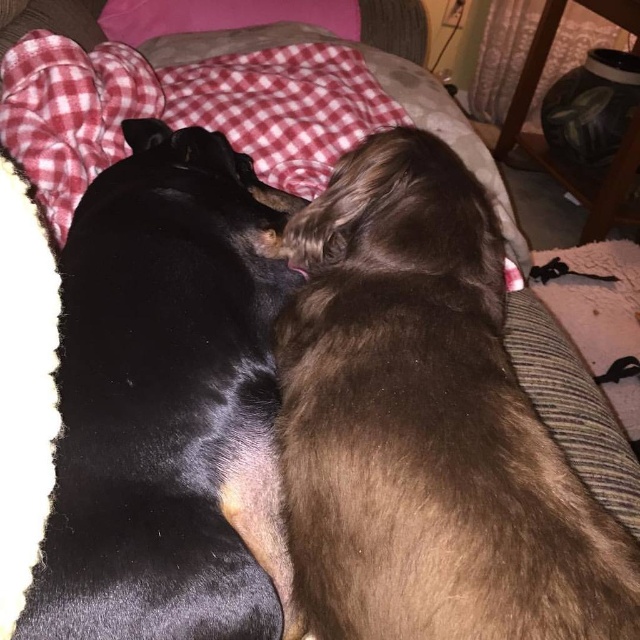
Question: Can you confirm if brown fluffy dog at upper center is positioned to the left of black soft fur dog at center?

Choices:
 (A) yes
 (B) no

Answer: (B)

Question: Which of the following is the closest to the observer?

Choices:
 (A) (556, 502)
 (B) (248, 531)

Answer: (A)

Question: Is brown fluffy dog at upper center below red plaid blanket at upper left?

Choices:
 (A) no
 (B) yes

Answer: (B)

Question: Among these objects, which one is nearest to the camera?

Choices:
 (A) red plaid blanket at upper left
 (B) brown fluffy dog at upper center
 (C) black soft fur dog at center

Answer: (B)

Question: Which object appears farthest from the camera in this image?

Choices:
 (A) red plaid blanket at upper left
 (B) brown fluffy dog at upper center

Answer: (A)

Question: From the image, what is the correct spatial relationship of brown fluffy dog at upper center in relation to black soft fur dog at center?

Choices:
 (A) left
 (B) right

Answer: (B)